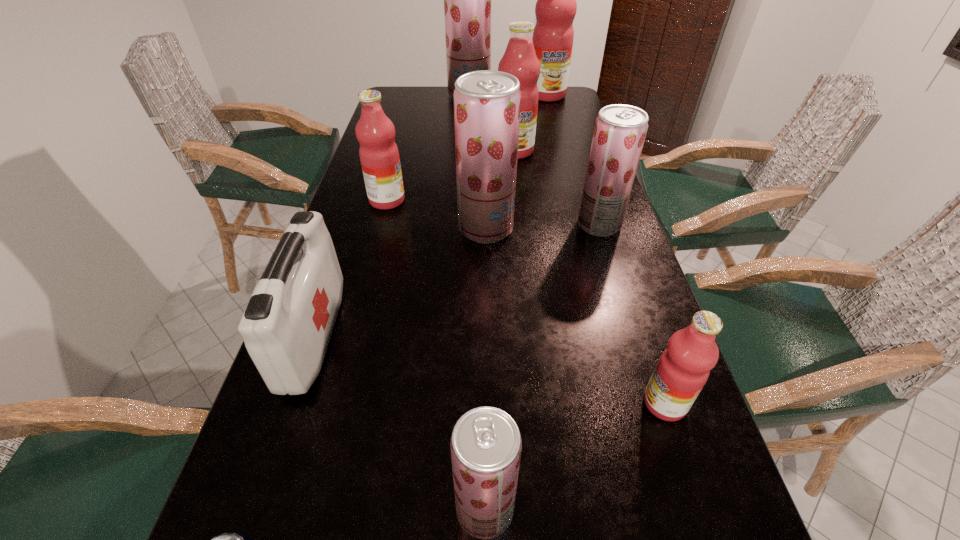
At what (x,y) coordinates should I click in order to perform the action: click on the first-aid kit. Please return your answer as a coordinate pair (x, y). The image size is (960, 540). Looking at the image, I should click on (286, 327).

Find the location of a particular element. The height and width of the screenshot is (540, 960). blank area located 0.390m on the front of the farthest strawberry fruit juice is located at coordinates (467, 153).

What are the coordinates of `vacant area located on the label of the farthest pink fruit juice` in the screenshot? It's located at (556, 127).

You are a GUI agent. You are given a task and a screenshot of the screen. Output one action in this format:
    pyautogui.click(x=<x>, y=<y>)
    Task: Click on the blank area located on the front of the third smallest strawberry fruit juice
    
    Given the screenshot: What is the action you would take?
    pyautogui.click(x=488, y=363)

Identify the location of vacant space located 0.070m on the label of the third farthest object. The width and height of the screenshot is (960, 540). (516, 172).

At what (x,y) coordinates should I click in order to perform the action: click on free space located 0.310m on the left of the rightmost strawberry fruit juice. Please return your answer as a coordinate pair (x, y). The height and width of the screenshot is (540, 960). Looking at the image, I should click on (459, 225).

This screenshot has width=960, height=540. In order to click on vacant space located 0.270m on the label of the fourth farthest fruit juice in this screenshot , I will do `click(501, 200)`.

This screenshot has height=540, width=960. Find the location of `free space located 0.390m on the label of the nearest pink fruit juice`. free space located 0.390m on the label of the nearest pink fruit juice is located at coordinates (423, 403).

The image size is (960, 540). Identify the location of free space located on the label of the nearest pink fruit juice. (418, 403).

You are a GUI agent. You are given a task and a screenshot of the screen. Output one action in this format:
    pyautogui.click(x=<x>, y=<y>)
    Task: Click on the vacant space situated on the label of the nearest pink fruit juice
    The width and height of the screenshot is (960, 540).
    Given the screenshot: What is the action you would take?
    pyautogui.click(x=587, y=403)